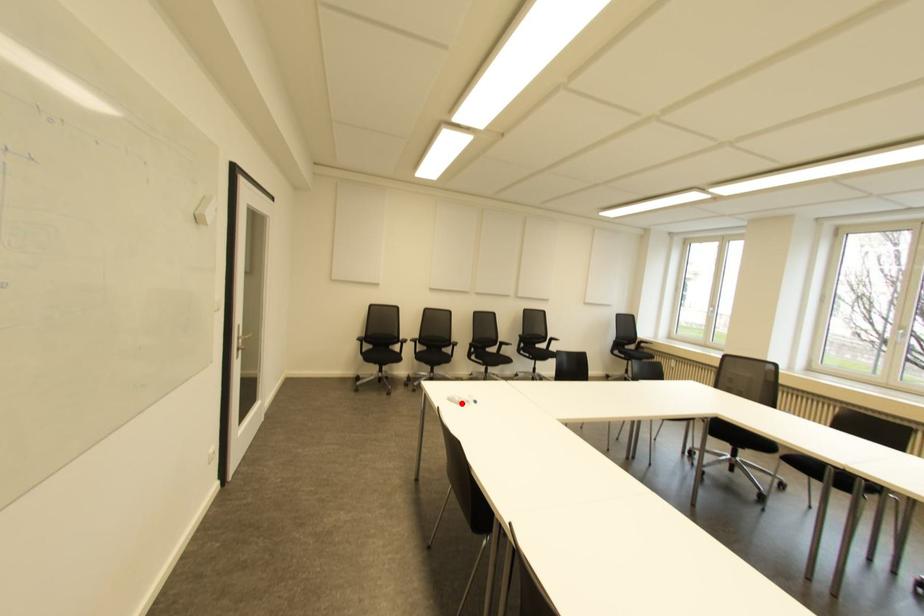
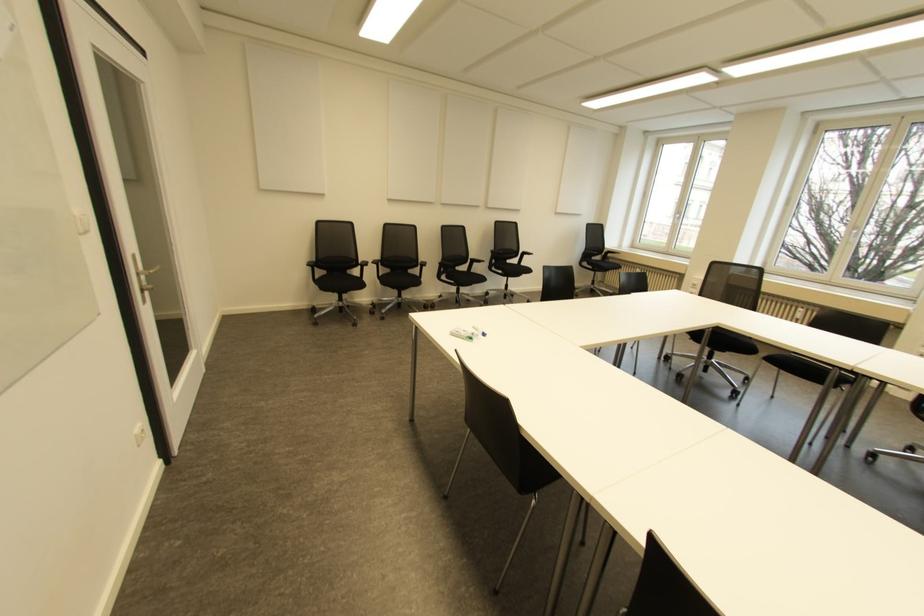
Locate, in the second image, the point that corresponds to the highlighted location in the first image.

(470, 338)